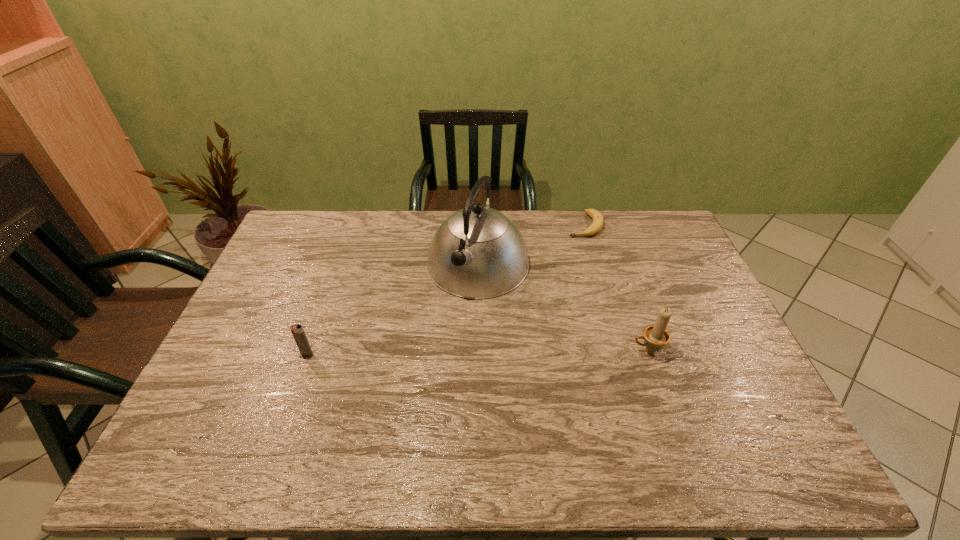
Where is `vacant space on the desktop that is between the leftmost object and the second tallest object and is positioned at the stem of the shortest object`? The width and height of the screenshot is (960, 540). vacant space on the desktop that is between the leftmost object and the second tallest object and is positioned at the stem of the shortest object is located at coordinates (525, 352).

This screenshot has height=540, width=960. I want to click on vacant space on the desktop that is between the third tallest object and the candle_holder and is positioned from the spout of the tallest object, so click(x=432, y=353).